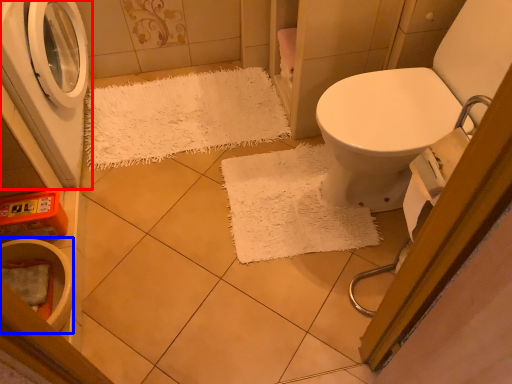
Question: Which object is further to the camera taking this photo, washing machine (highlighted by a red box) or toilet bowl (highlighted by a blue box)?

Choices:
 (A) washing machine
 (B) toilet bowl

Answer: (B)